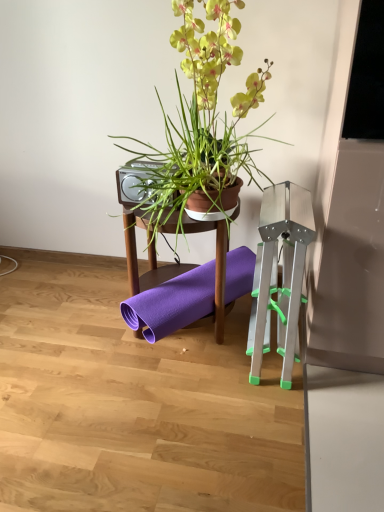
The height and width of the screenshot is (512, 384). I want to click on vacant area situated to the left side of purple rubber yoga mat at center, so click(85, 320).